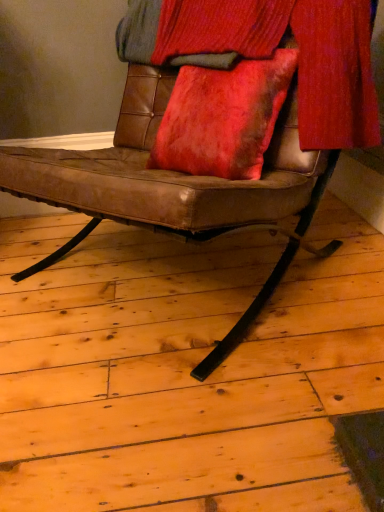
This screenshot has height=512, width=384. What do you see at coordinates (269, 53) in the screenshot? I see `velvet red curtain at upper center` at bounding box center [269, 53].

The height and width of the screenshot is (512, 384). Identify the location of velvet red curtain at upper center. (269, 53).

This screenshot has height=512, width=384. What do you see at coordinates (173, 188) in the screenshot? I see `brown leather chair at center` at bounding box center [173, 188].

Where is `brown leather chair at center`? The height and width of the screenshot is (512, 384). brown leather chair at center is located at coordinates (173, 188).

Identify the location of velvet red curtain at upper center. [x=269, y=53].

Visually, is brown leather chair at center positioned to the left or to the right of velvet red curtain at upper center?

Based on their positions, brown leather chair at center is located to the left of velvet red curtain at upper center.

Does brown leather chair at center lie behind velvet red curtain at upper center?

No.

Is point (153, 224) positioned before point (180, 48)?

Yes.

From the image's perspective, is brown leather chair at center beneath velvet red curtain at upper center?

Correct, brown leather chair at center appears lower than velvet red curtain at upper center in the image.

From a real-world perspective, is brown leather chair at center on top of velvet red curtain at upper center?

Actually, brown leather chair at center is physically below velvet red curtain at upper center in the real world.

Consider the image. Considering the relative sizes of brown leather chair at center and velvet red curtain at upper center in the image provided, is brown leather chair at center wider than velvet red curtain at upper center?

Yes.

Is brown leather chair at center taller than velvet red curtain at upper center?

Correct, brown leather chair at center is much taller as velvet red curtain at upper center.

Is brown leather chair at center smaller than velvet red curtain at upper center?

Actually, brown leather chair at center might be larger than velvet red curtain at upper center.

Is brown leather chair at center spatially inside velvet red curtain at upper center, or outside of it?

brown leather chair at center is spatially situated outside velvet red curtain at upper center.

Are brown leather chair at center and velvet red curtain at upper center far apart?

No, brown leather chair at center is not far from velvet red curtain at upper center.

Is brown leather chair at center looking in the opposite direction of velvet red curtain at upper center?

Absolutely, brown leather chair at center is directed away from velvet red curtain at upper center.

How different are the orientations of brown leather chair at center and velvet red curtain at upper center in degrees?

The angular difference between brown leather chair at center and velvet red curtain at upper center is 0.0019 degrees.

How far apart are brown leather chair at center and velvet red curtain at upper center?

brown leather chair at center and velvet red curtain at upper center are 9.43 inches apart from each other.

Image resolution: width=384 pixels, height=512 pixels. I want to click on chair in front of the velvet red curtain at upper center, so (x=173, y=188).

Is velvet red curtain at upper center at the right side of brown leather chair at center?

Indeed, velvet red curtain at upper center is positioned on the right side of brown leather chair at center.

Which object is more forward, velvet red curtain at upper center or brown leather chair at center?

Positioned in front is brown leather chair at center.

Considering the positions of point (151, 52) and point (128, 101), is point (151, 52) closer or farther from the camera than point (128, 101)?

Point (151, 52) is positioned closer to the camera compared to point (128, 101).

From the image's perspective, does velvet red curtain at upper center appear higher than brown leather chair at center?

Yes, from the image's perspective, velvet red curtain at upper center is over brown leather chair at center.

From a real-world perspective, is velvet red curtain at upper center physically above brown leather chair at center?

Yes.

Between velvet red curtain at upper center and brown leather chair at center, which one has smaller width?

Thinner between the two is velvet red curtain at upper center.

Considering the sizes of objects velvet red curtain at upper center and brown leather chair at center in the image provided, who is shorter, velvet red curtain at upper center or brown leather chair at center?

Standing shorter between the two is velvet red curtain at upper center.

Which of these two, velvet red curtain at upper center or brown leather chair at center, is smaller?

Smaller between the two is velvet red curtain at upper center.

Is velvet red curtain at upper center not inside brown leather chair at center?

That's incorrect, velvet red curtain at upper center is not completely outside brown leather chair at center.

Consider the image. Is velvet red curtain at upper center beside brown leather chair at center?

No, velvet red curtain at upper center is not touching brown leather chair at center.

Looking at this image, is velvet red curtain at upper center turned away from brown leather chair at center?

Absolutely, velvet red curtain at upper center is directed away from brown leather chair at center.

This screenshot has width=384, height=512. What are the coordinates of `curtain behind the brown leather chair at center` in the screenshot? It's located at (269, 53).

Find the location of a particular element. curtain above the brown leather chair at center (from the image's perspective) is located at coordinates (269, 53).

Image resolution: width=384 pixels, height=512 pixels. I want to click on curtain on the right of brown leather chair at center, so click(269, 53).